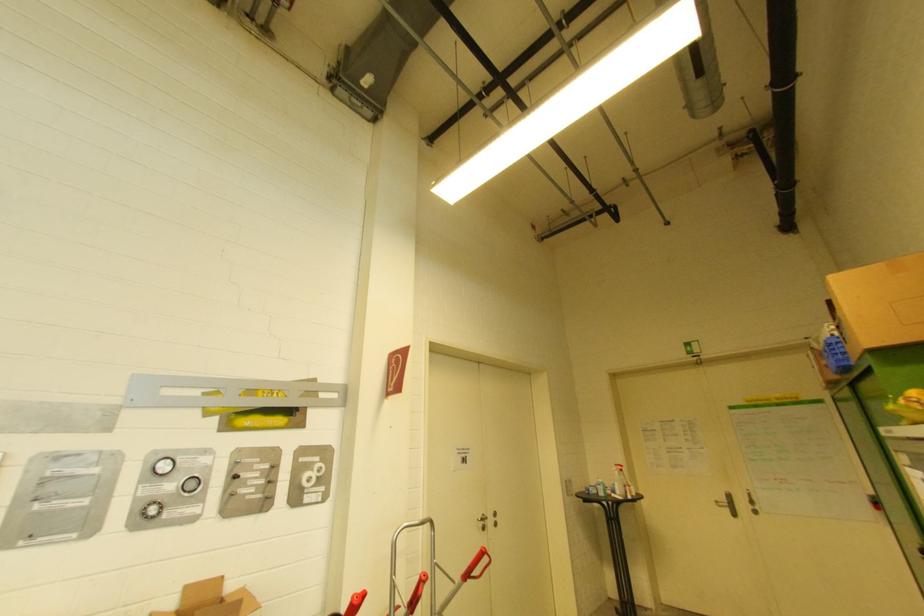
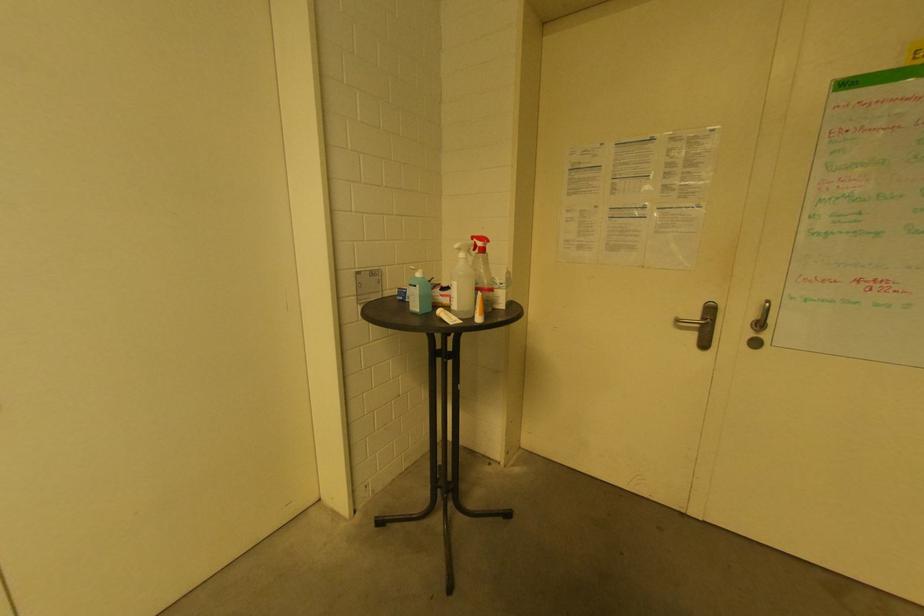
Where in the second image is the point corresponding to (x=754, y=504) from the first image?

(761, 326)